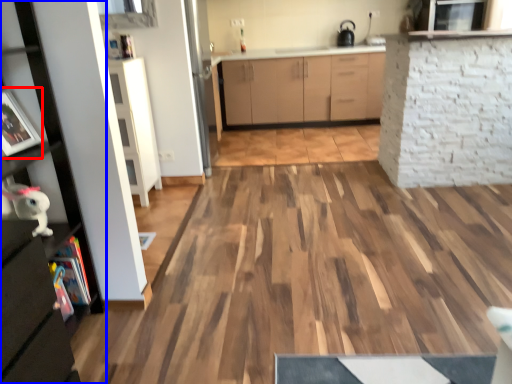
Question: Which point is further to the camera, picture frame (highlighted by a red box) or cabinetry (highlighted by a blue box)?

Choices:
 (A) picture frame
 (B) cabinetry

Answer: (A)